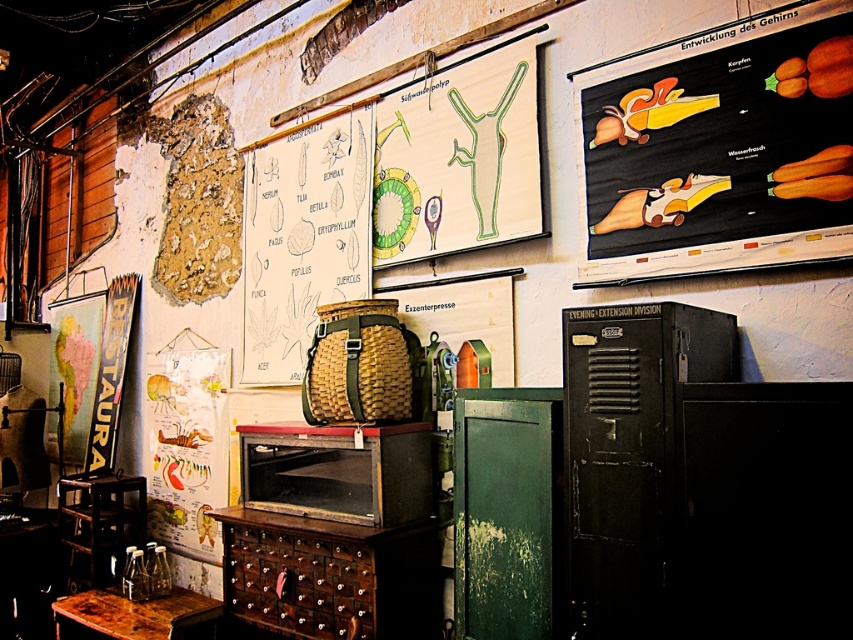
You are standing in the middle of the room and want to place a new item on the black metal locker at center. Based on the scene description, is the locker positioned in a central area of the room?

The black metal locker at center is located at point (x=630, y=456), which indicates it is centrally positioned in the room, so yes, it is in a central area.